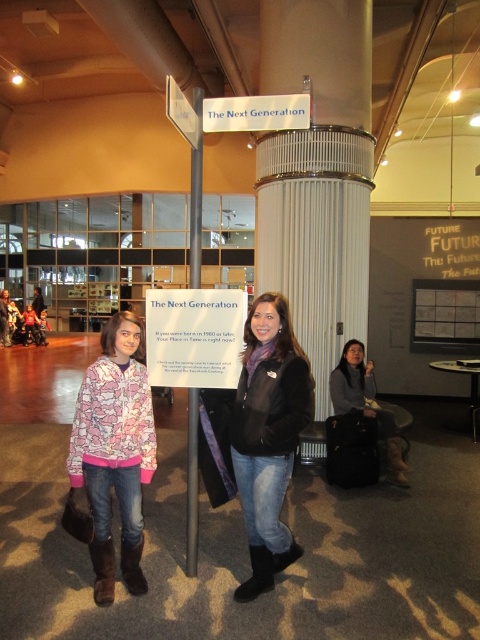
Does pink printed jacket at center appear on the left side of black leather jacket at center?

Indeed, pink printed jacket at center is positioned on the left side of black leather jacket at center.

Is the position of pink printed jacket at center more distant than that of black leather jacket at center?

Yes.

What do you see at coordinates (111, 456) in the screenshot? This screenshot has height=640, width=480. I see `pink printed jacket at center` at bounding box center [111, 456].

Identify the location of pink printed jacket at center. This screenshot has height=640, width=480. (111, 456).

Is point (196, 259) closer to viewer compared to point (340, 358)?

Yes.

Can you confirm if white glossy pole at center is positioned to the left of dark gray sweater at center?

Correct, you'll find white glossy pole at center to the left of dark gray sweater at center.

Where is `white glossy pole at center`? Image resolution: width=480 pixels, height=640 pixels. white glossy pole at center is located at coordinates (192, 484).

Where is `white glossy pole at center`? Image resolution: width=480 pixels, height=640 pixels. white glossy pole at center is located at coordinates (192, 484).

At what (x,y) coordinates should I click in order to perform the action: click on black leather jacket at center. Please return your answer as a coordinate pair (x, y). The width and height of the screenshot is (480, 640). Looking at the image, I should click on (267, 435).

Which of these two, black leather jacket at center or white glossy pole at center, stands shorter?

white glossy pole at center is shorter.

At what (x,y) coordinates should I click in order to perform the action: click on black leather jacket at center. Please return your answer as a coordinate pair (x, y). Looking at the image, I should click on (267, 435).